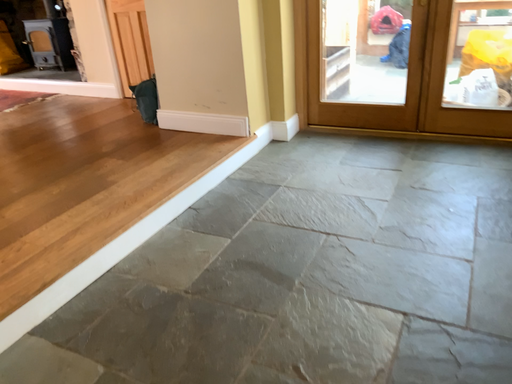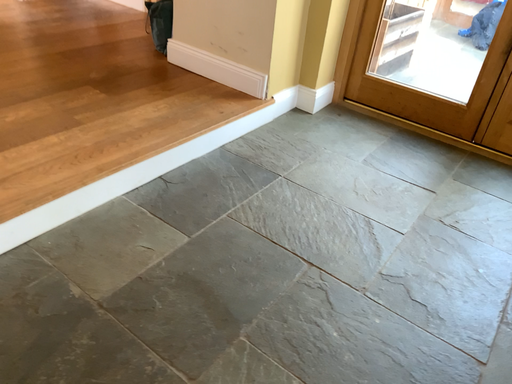
Question: How did the camera likely rotate when shooting the video?

Choices:
 (A) rotated upward
 (B) rotated downward

Answer: (B)